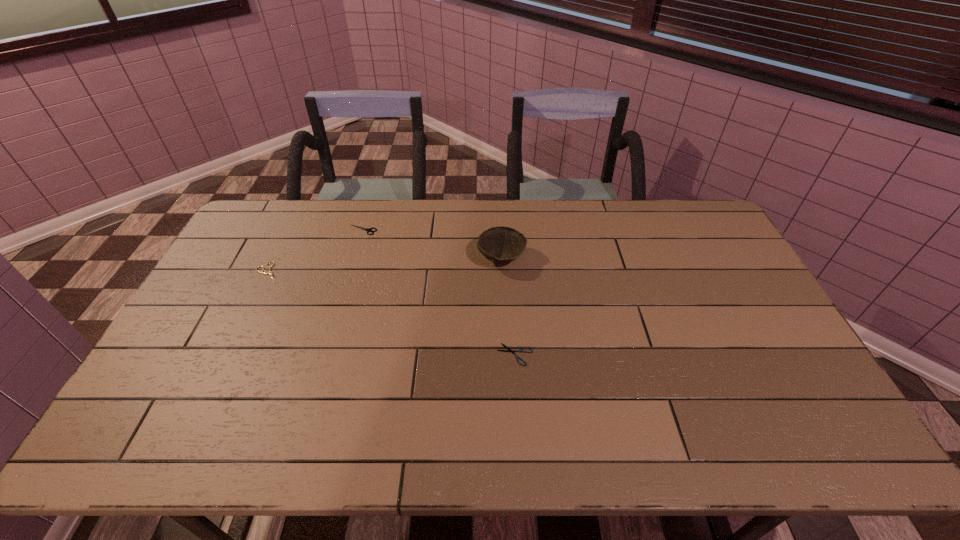
The image size is (960, 540). What are the coordinates of `empty space that is in between the second tallest object and the leftmost shears` in the screenshot? It's located at (316, 251).

I want to click on free spot between the shortest shears and the farthest shears, so click(x=439, y=292).

Find the location of a particular element. This screenshot has height=540, width=960. empty space that is in between the leftmost object and the tallest shears is located at coordinates (316, 251).

Where is `vacant region between the tallest shears and the rightmost shears`? vacant region between the tallest shears and the rightmost shears is located at coordinates (439, 292).

The image size is (960, 540). I want to click on vacant area that lies between the second shortest shears and the shortest object, so click(392, 314).

Locate an element on the screen. The height and width of the screenshot is (540, 960). empty space that is in between the second tallest object and the second shortest shears is located at coordinates (316, 251).

The image size is (960, 540). Identify the location of vacant area that lies between the farthest object and the leftmost object. tap(316, 251).

Find the location of a particular element. The width and height of the screenshot is (960, 540). free space between the second farthest shears and the bowl is located at coordinates (385, 266).

Locate an element on the screen. This screenshot has width=960, height=540. vacant area between the bowl and the tallest shears is located at coordinates (432, 244).

I want to click on object identified as the second closest to the shortest shears, so (366, 229).